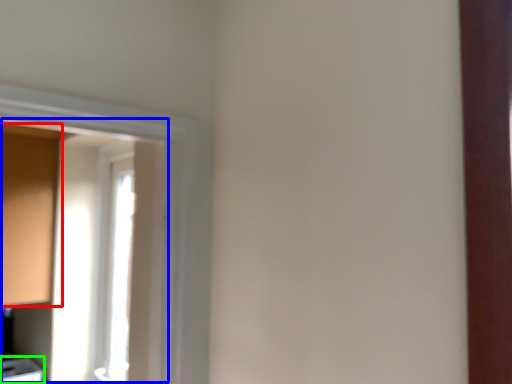
Question: Based on their relative distances, which object is farther from cabinetry (highlighted by a red box)? Choose from window screen (highlighted by a blue box) and cabinetry (highlighted by a green box).

Choices:
 (A) window screen
 (B) cabinetry

Answer: (B)